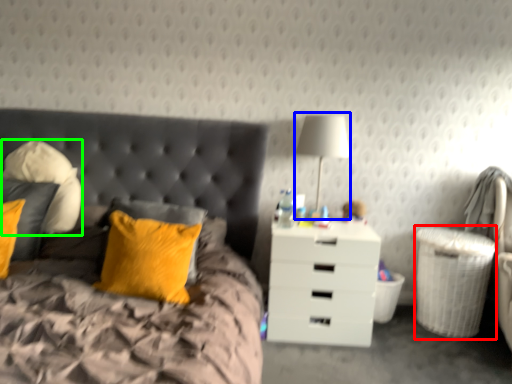
Question: Estimate the real-world distances between objects in this image. Which object is farther from laundry basket (highlighted by a red box), bedside lamp (highlighted by a blue box) or pillow (highlighted by a green box)?

Choices:
 (A) bedside lamp
 (B) pillow

Answer: (B)